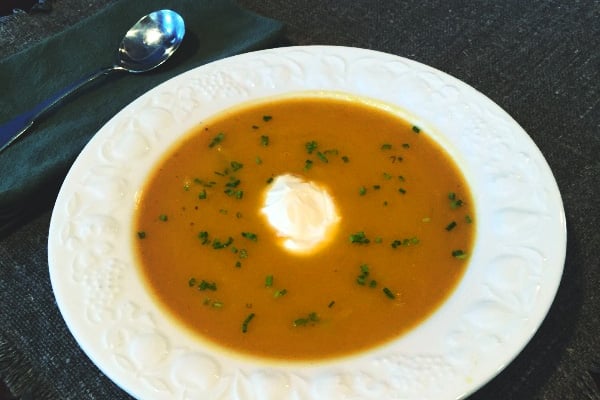
Image resolution: width=600 pixels, height=400 pixels. I want to click on plate, so (510, 155), (505, 306), (347, 73), (206, 90), (121, 168), (96, 342), (302, 395).